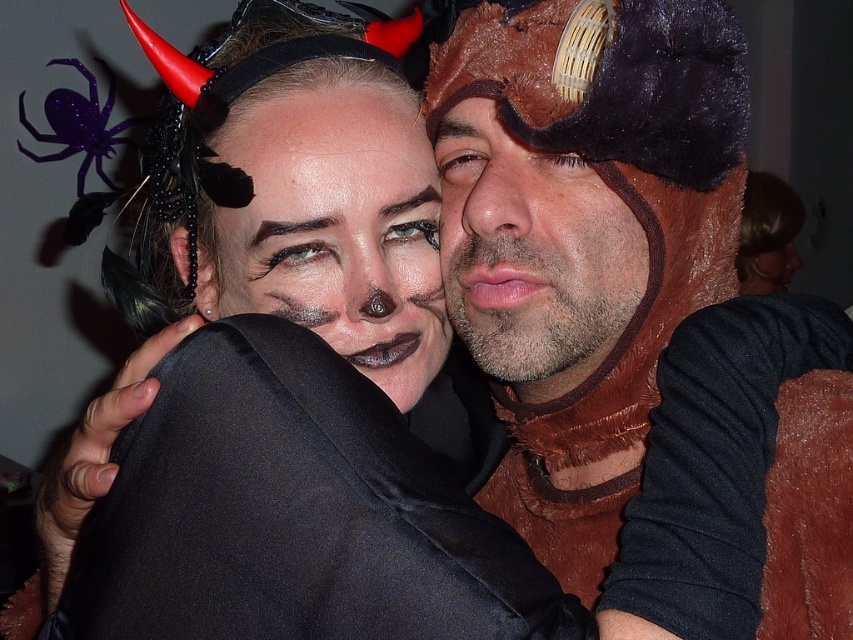
Does matte black face at center have a larger size compared to purple glittery spider at upper left?

No, matte black face at center is not bigger than purple glittery spider at upper left.

Is matte black face at center below purple glittery spider at upper left?

Yes, matte black face at center is below purple glittery spider at upper left.

You are a GUI agent. You are given a task and a screenshot of the screen. Output one action in this format:
    pyautogui.click(x=<x>, y=<y>)
    Task: Click on the matte black face at center
    
    Given the screenshot: What is the action you would take?
    pyautogui.click(x=335, y=228)

Which is in front, point (486, 304) or point (67, 93)?

Point (486, 304) is in front.

Does brown furry hat at center have a lesser width compared to purple glittery spider at upper left?

Yes, brown furry hat at center is thinner than purple glittery spider at upper left.

Is point (608, 275) farther from camera compared to point (86, 72)?

No, it is not.

Where is `brown furry hat at center`? The width and height of the screenshot is (853, 640). brown furry hat at center is located at coordinates (531, 253).

Is black satin jacket at center to the right of purple glittery spider at upper left from the viewer's perspective?

Indeed, black satin jacket at center is positioned on the right side of purple glittery spider at upper left.

Is black satin jacket at center closer to camera compared to purple glittery spider at upper left?

Yes.

Which is behind, point (379, 600) or point (90, 134)?

The point (90, 134) is behind.

Identify the location of black satin jacket at center. This screenshot has width=853, height=640. (293, 513).